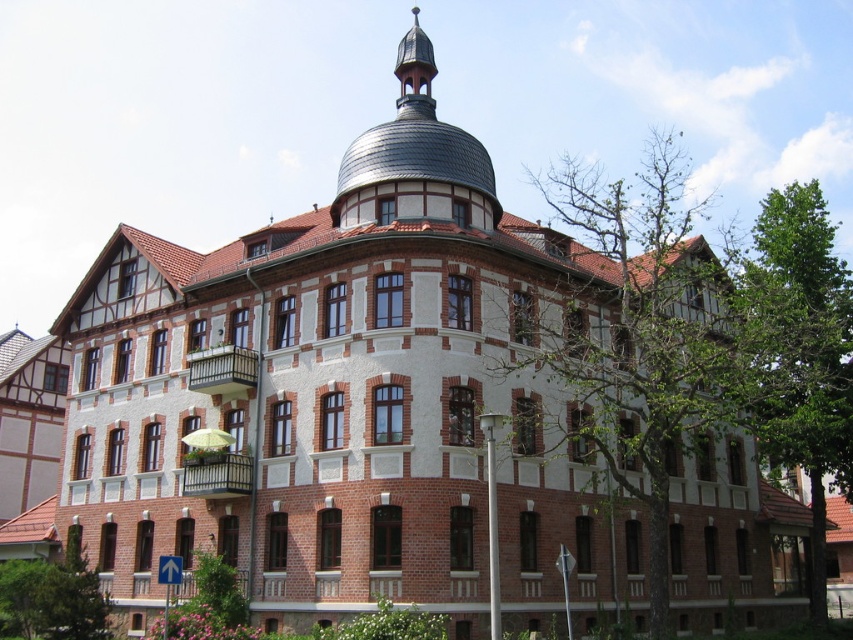
Question: Which of the following is the farthest from the observer?

Choices:
 (A) (833, 396)
 (B) (621, 486)

Answer: (B)

Question: Is green leafy tree at upper right positioned behind green leafy tree at right?

Choices:
 (A) no
 (B) yes

Answer: (A)

Question: From the image, what is the correct spatial relationship of green leafy tree at upper right in relation to green leafy tree at right?

Choices:
 (A) below
 (B) above

Answer: (B)

Question: Which of the following is the farthest from the observer?

Choices:
 (A) green leafy tree at right
 (B) green leafy tree at upper right

Answer: (A)

Question: Does green leafy tree at upper right appear under green leafy tree at right?

Choices:
 (A) yes
 (B) no

Answer: (B)